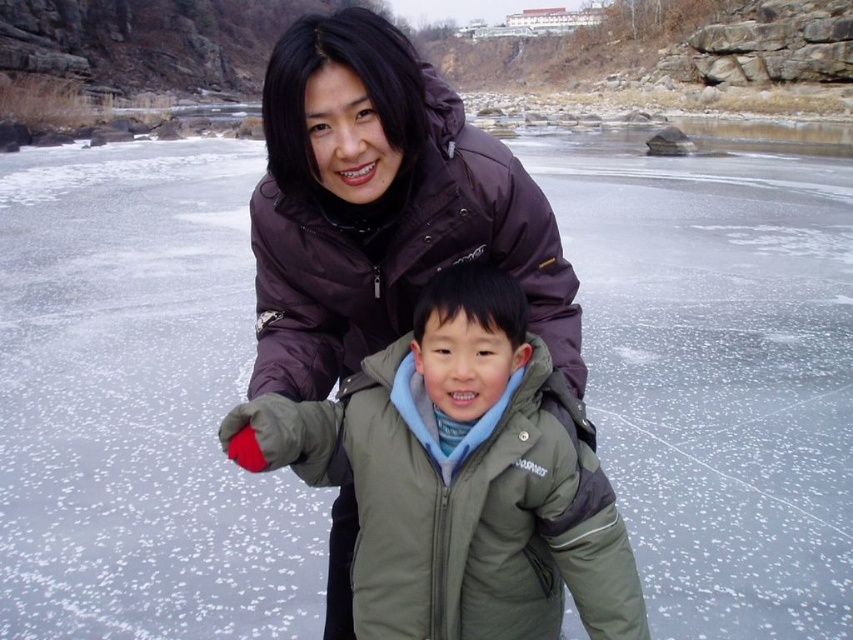
Can you confirm if green fuzzy jacket at center is wider than dark purple down jacket at center?

Yes.

Which is more to the left, green fuzzy jacket at center or dark purple down jacket at center?

dark purple down jacket at center

Is point (543, 445) more distant than point (316, 362)?

No, it is not.

Locate an element on the screen. Image resolution: width=853 pixels, height=640 pixels. green fuzzy jacket at center is located at coordinates (460, 476).